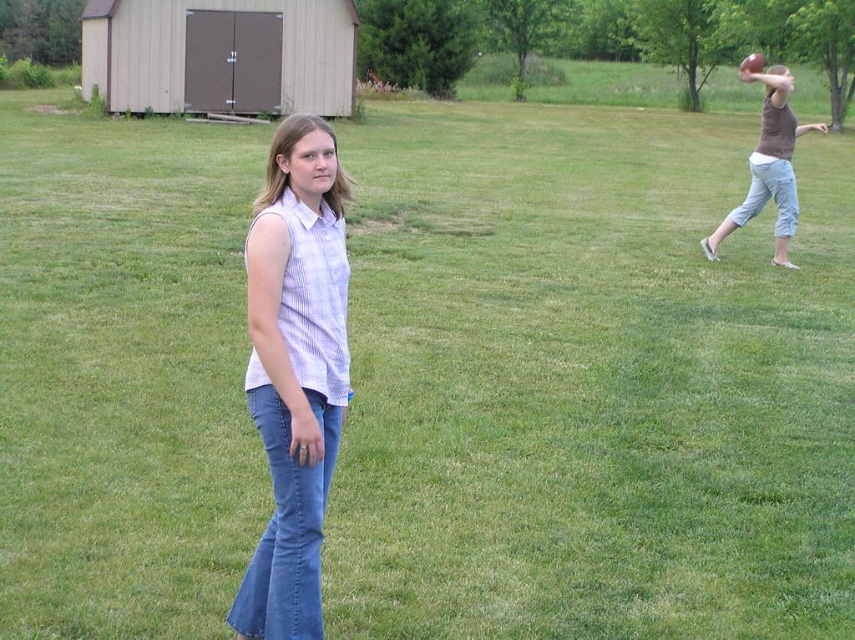
Question: Can you confirm if denim jeans at center is positioned to the right of brown cotton shirt at upper right?

Choices:
 (A) no
 (B) yes

Answer: (A)

Question: Can you confirm if denim jeans at center is positioned to the right of brown cotton shirt at upper right?

Choices:
 (A) yes
 (B) no

Answer: (B)

Question: Among these points, which one is nearest to the camera?

Choices:
 (A) (276, 184)
 (B) (774, 200)

Answer: (A)

Question: Among these points, which one is farthest from the camera?

Choices:
 (A) tap(257, 372)
 (B) tap(700, 241)

Answer: (B)

Question: Does denim jeans at center have a larger size compared to brown cotton shirt at upper right?

Choices:
 (A) yes
 (B) no

Answer: (B)